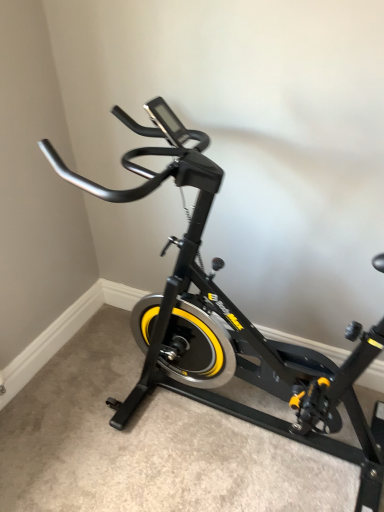
Identify the location of free location to the left of black matte stationary bicycle at center. (90, 426).